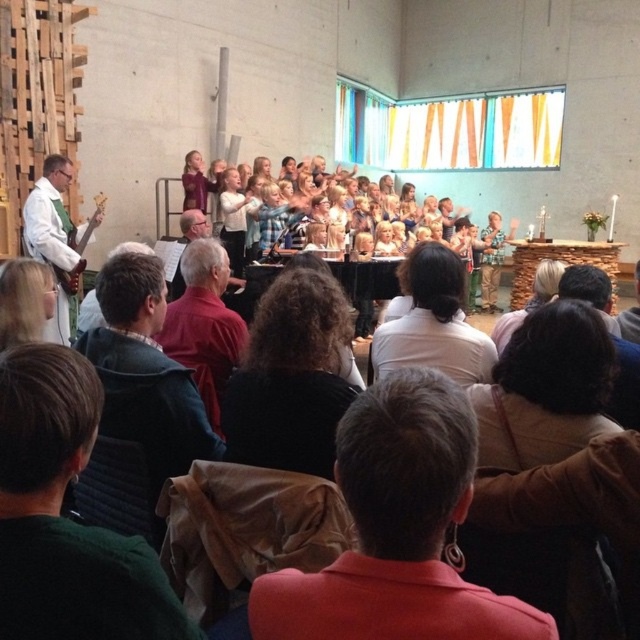
You are an event photographer at the back of the stage. You need to capture a photo of the red shirt at center and the white matte guitar at left. Which object will appear larger in your photo?

The white matte guitar at left will appear larger in the photo because it is bigger in size compared to the red shirt at center.

You are an audience member sitting in the front row of the performance. You notice the red shirt at center and the white matte guitar at left. Which object is positioned lower in the scene?

The red shirt at center is located below the white matte guitar at left, so it is positioned lower in the scene.